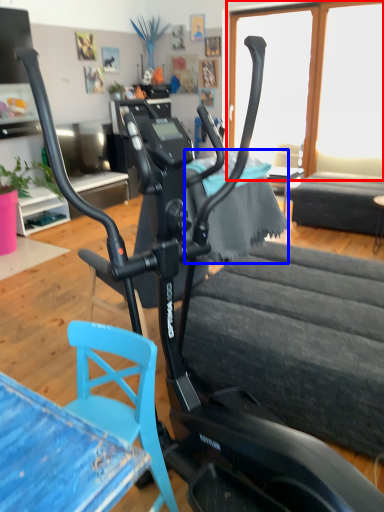
Question: Among these objects, which one is farthest to the camera, window screen (highlighted by a red box) or fabric (highlighted by a blue box)?

Choices:
 (A) window screen
 (B) fabric

Answer: (A)